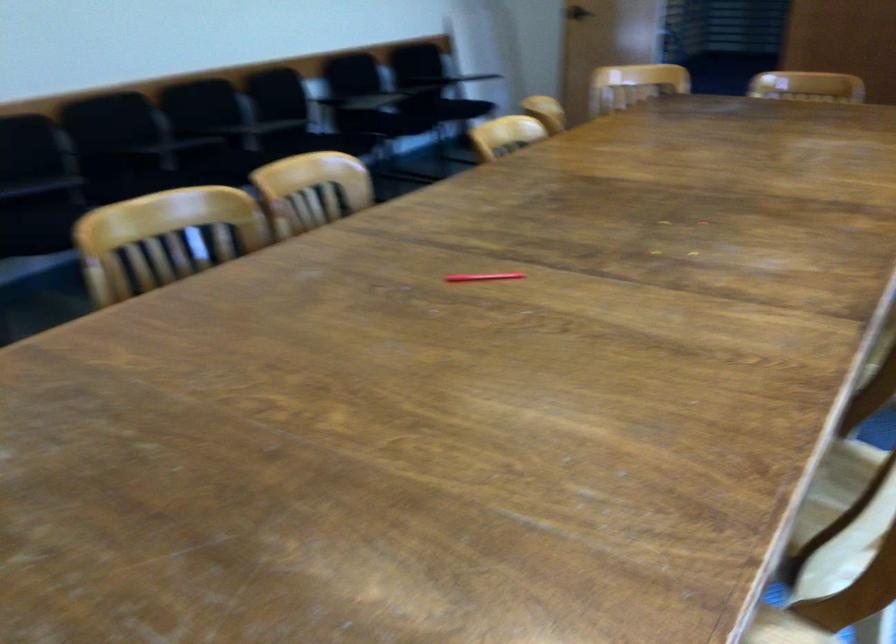
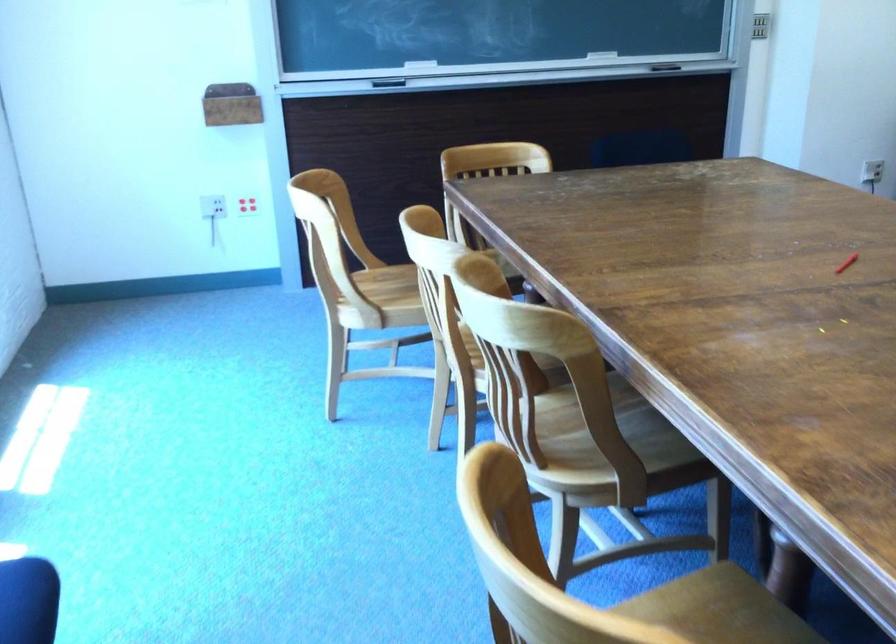
The point at (455, 270) is marked in the first image. Where is the corresponding point in the second image?

(846, 263)